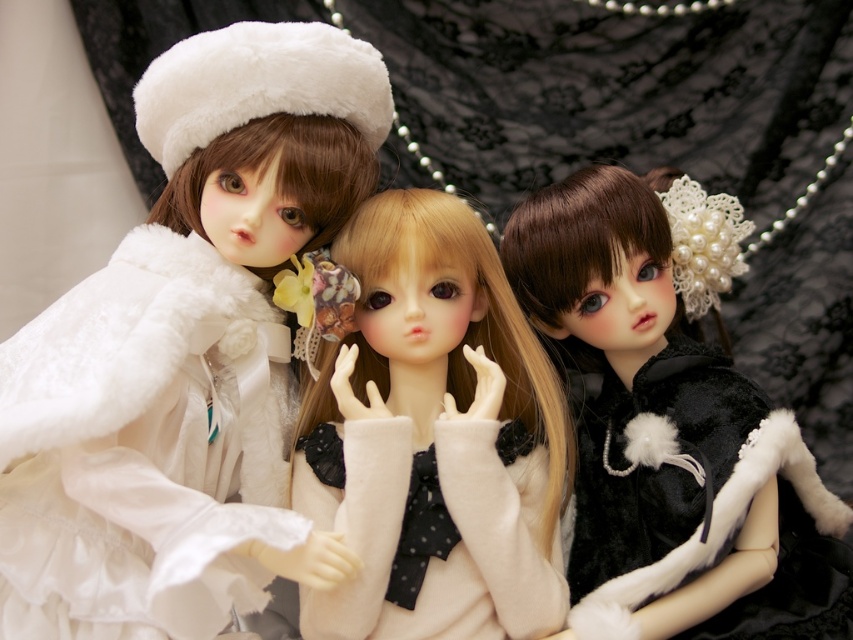
Question: Considering the real-world distances, which object is closest to the white fluffy hat at upper left?

Choices:
 (A) velvet black coat at center
 (B) matte white sweater at center

Answer: (B)

Question: Does matte white sweater at center have a greater width compared to white fuzzy sweater at center?

Choices:
 (A) no
 (B) yes

Answer: (B)

Question: Can you confirm if velvet black coat at center is smaller than matte white sweater at center?

Choices:
 (A) no
 (B) yes

Answer: (A)

Question: Estimate the real-world distances between objects in this image. Which object is closer to the velvet black coat at center?

Choices:
 (A) matte white sweater at center
 (B) white fluffy hat at upper left

Answer: (A)

Question: Is the position of velvet black coat at center less distant than that of white fuzzy sweater at center?

Choices:
 (A) yes
 (B) no

Answer: (A)

Question: Among these objects, which one is farthest from the camera?

Choices:
 (A) matte white sweater at center
 (B) velvet black coat at center
 (C) white fluffy hat at upper left

Answer: (A)